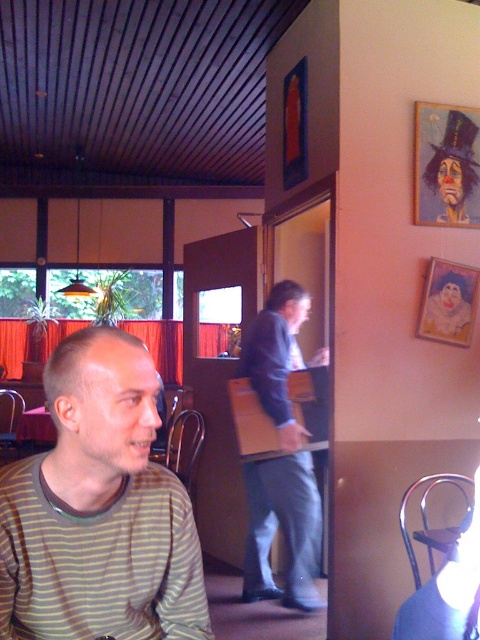
Question: Does dark blue suit at center have a smaller size compared to matte paper picture frame at upper right?

Choices:
 (A) no
 (B) yes

Answer: (A)

Question: Which point appears farthest from the camera in this image?

Choices:
 (A) (437, 301)
 (B) (432, 225)
 (C) (126, 406)

Answer: (B)

Question: Which point appears closest to the camera in this image?

Choices:
 (A) (477, 144)
 (B) (253, 481)
 (C) (431, 288)

Answer: (C)

Question: Which object is the closest to the matte paper picture frame at upper right?

Choices:
 (A) dark blue suit at center
 (B) striped cotton shirt at center

Answer: (A)

Question: Can you confirm if wooden framed portrait at upper right is positioned to the left of matte paper picture frame at upper right?

Choices:
 (A) yes
 (B) no

Answer: (A)

Question: Does striped cotton shirt at center appear over dark blue suit at center?

Choices:
 (A) no
 (B) yes

Answer: (B)